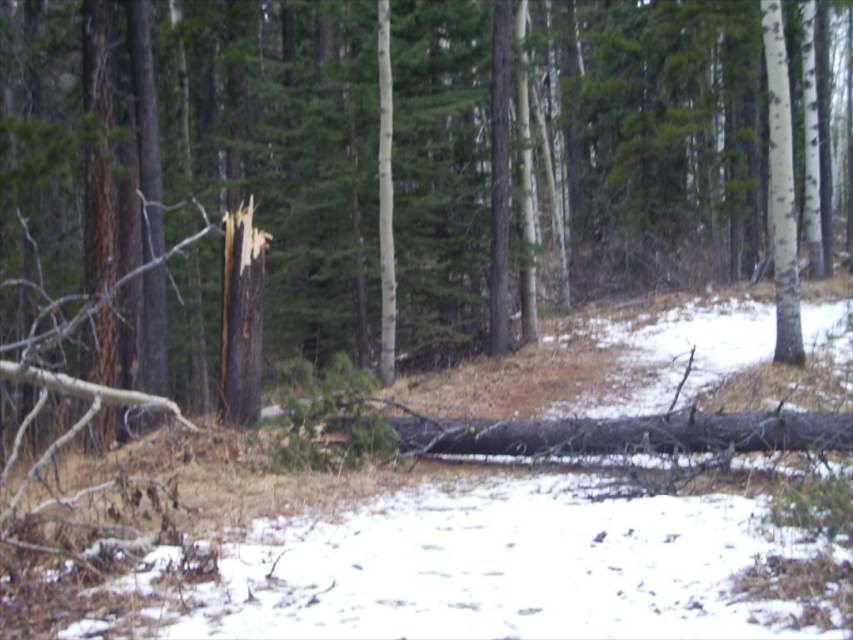
Question: Can you confirm if dark brown bark at center is positioned below dark brown wood at center?

Choices:
 (A) no
 (B) yes

Answer: (A)

Question: Does dark brown bark at center have a smaller size compared to dark brown wood at center?

Choices:
 (A) yes
 (B) no

Answer: (B)

Question: Which point appears closest to the camera in this image?

Choices:
 (A) (227, 225)
 (B) (625, 221)

Answer: (A)

Question: Which point is closer to the camera taking this photo?

Choices:
 (A) (242, 392)
 (B) (674, 275)

Answer: (A)

Question: Does dark brown bark at center come behind dark brown wood at center?

Choices:
 (A) yes
 (B) no

Answer: (A)